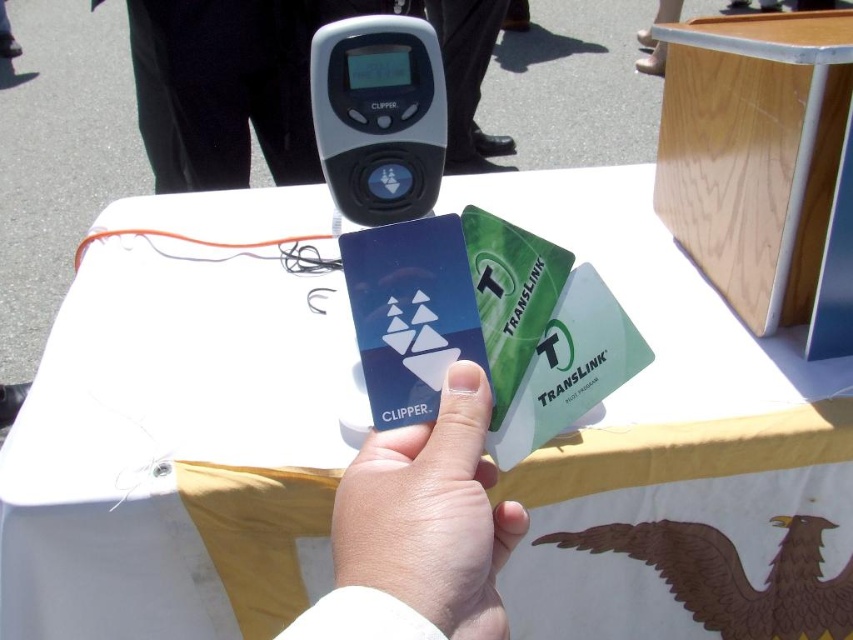
Is white matte hand at center positioned before brown matte/eagle at lower right?

Yes, white matte hand at center is in front of brown matte/eagle at lower right.

Does point (418, 554) come behind point (805, 600)?

No, (418, 554) is in front of (805, 600).

The width and height of the screenshot is (853, 640). What are the coordinates of `white matte hand at center` in the screenshot? It's located at (430, 515).

Can you confirm if white matte hand at center is thinner than blue plastic card at center?

No, white matte hand at center is not thinner than blue plastic card at center.

Which of these two, white matte hand at center or blue plastic card at center, stands taller?

white matte hand at center

Is point (358, 481) positioned after point (357, 333)?

That is False.

The image size is (853, 640). Identify the location of white matte hand at center. (430, 515).

Can you confirm if white plastic table at center is wider than blue plastic card at center?

Indeed, white plastic table at center has a greater width compared to blue plastic card at center.

This screenshot has width=853, height=640. Describe the element at coordinates (177, 449) in the screenshot. I see `white plastic table at center` at that location.

Where is `white plastic table at center`? The height and width of the screenshot is (640, 853). white plastic table at center is located at coordinates (177, 449).